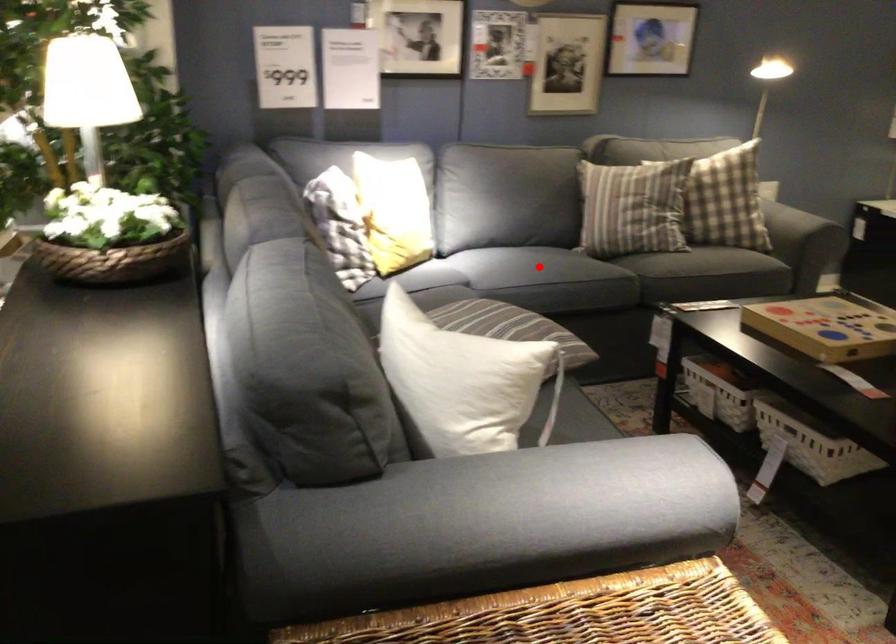
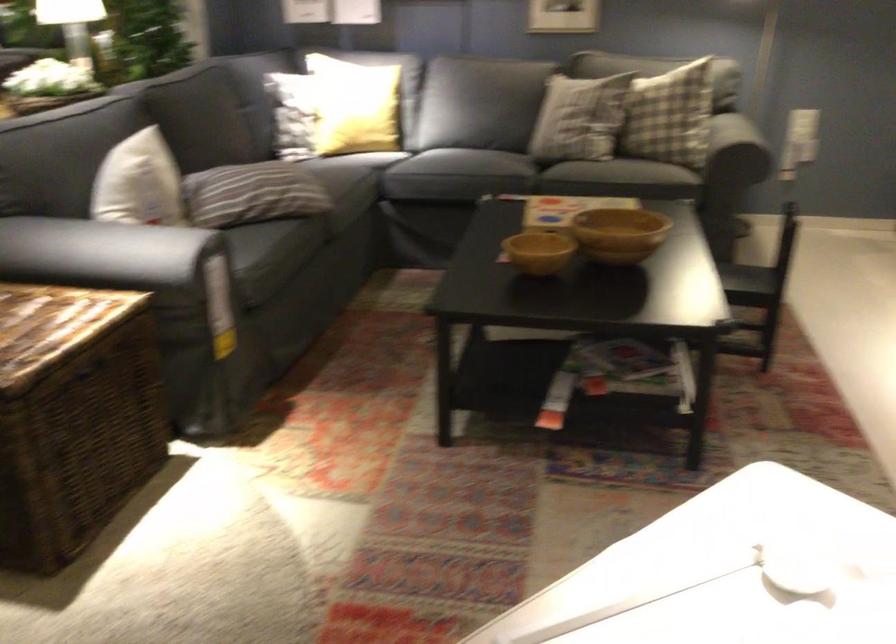
Question: I am providing you with two images of the same scene from different viewpoints. A red point is marked on the first image. At the location where the point appears in image 1, is it still visible in image 2?

Choices:
 (A) Yes
 (B) No

Answer: (B)